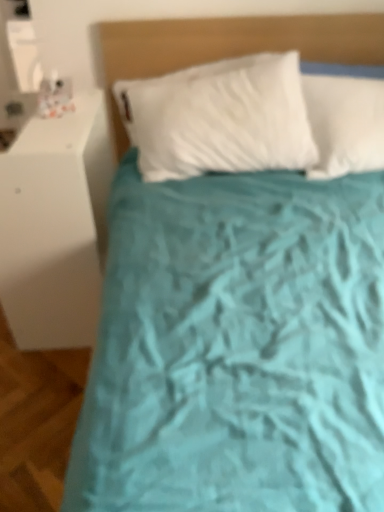
Locate an element on the screen. This screenshot has height=512, width=384. white matte dresser at left is located at coordinates (55, 226).

This screenshot has height=512, width=384. What do you see at coordinates (55, 226) in the screenshot?
I see `white matte dresser at left` at bounding box center [55, 226].

This screenshot has width=384, height=512. What are the coordinates of `white matte dresser at left` in the screenshot? It's located at (55, 226).